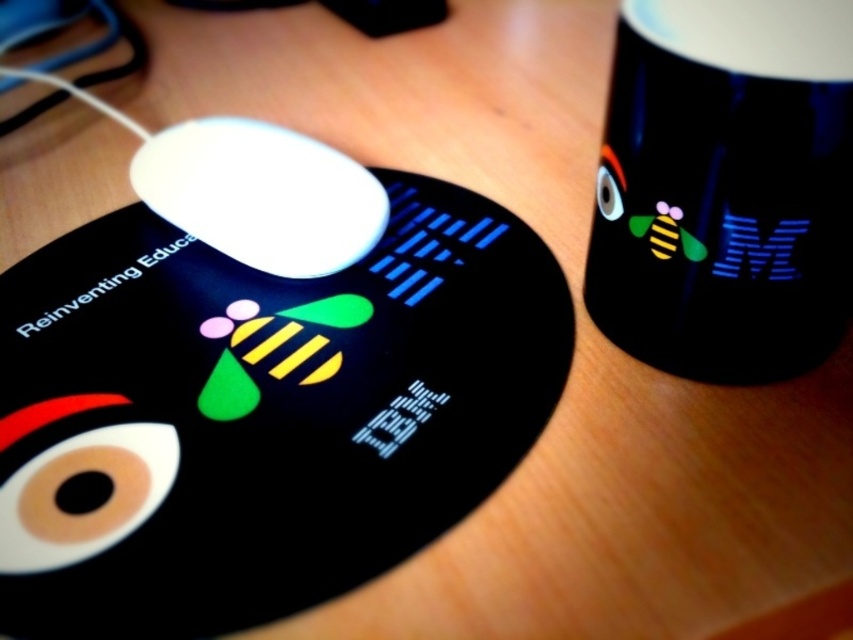
You are organizing a study session and need to place your white glossy mouse at center and black matte mug at upper right on the desk. According to the image, is the mug positioned above or below the mouse?

The black matte mug at upper right is below the white glossy mouse at center, so the mug is positioned below the mouse.

Based on the photo, you are a delivery robot that needs to place a package between the black matte mug at upper right and the white glossy mouse at center on a desk. The package requires a minimum of 18 inches of space. Can you fit it between them?

The distance between the black matte mug at upper right and the white glossy mouse at center is 19.46 inches, which is more than the required 18 inches. Therefore, the package can be placed between them.